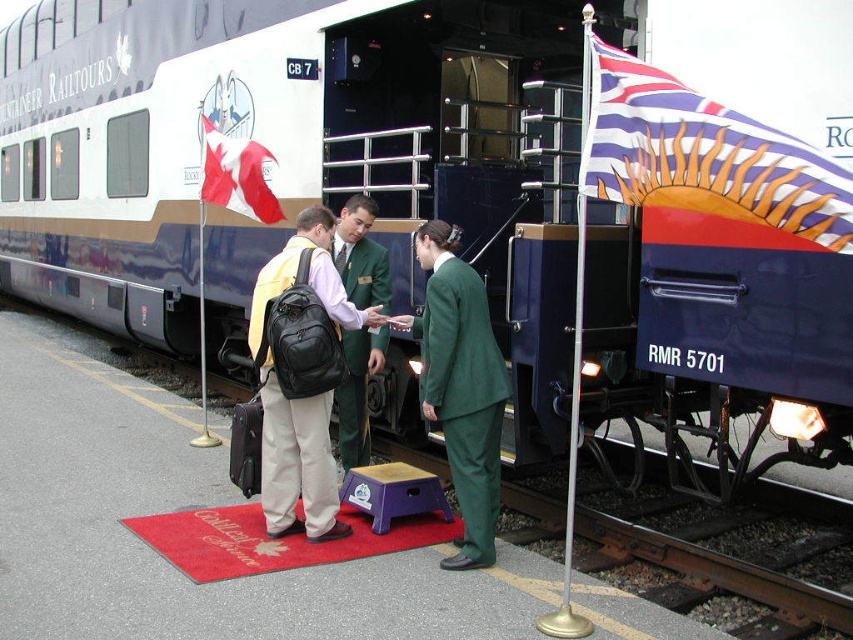
Question: Which point appears closest to the camera in this image?

Choices:
 (A) (477, 429)
 (B) (608, 163)
 (C) (340, 397)

Answer: (B)

Question: Does striped fabric flag at right have a greater width compared to matte black backpack at center?

Choices:
 (A) yes
 (B) no

Answer: (A)

Question: Can you confirm if green fabric suit at center is positioned above matte black backpack at center?

Choices:
 (A) yes
 (B) no

Answer: (A)

Question: Which point is farther to the camera?

Choices:
 (A) green fabric uniform at center
 (B) striped fabric flag at right
 (C) green fabric suit at center

Answer: (A)

Question: Is the position of green fabric uniform at center more distant than that of red fabric flag at upper left?

Choices:
 (A) no
 (B) yes

Answer: (A)

Question: Which of the following is the farthest from the observer?

Choices:
 (A) matte black backpack at center
 (B) green fabric uniform at center
 (C) green fabric suit at center

Answer: (B)